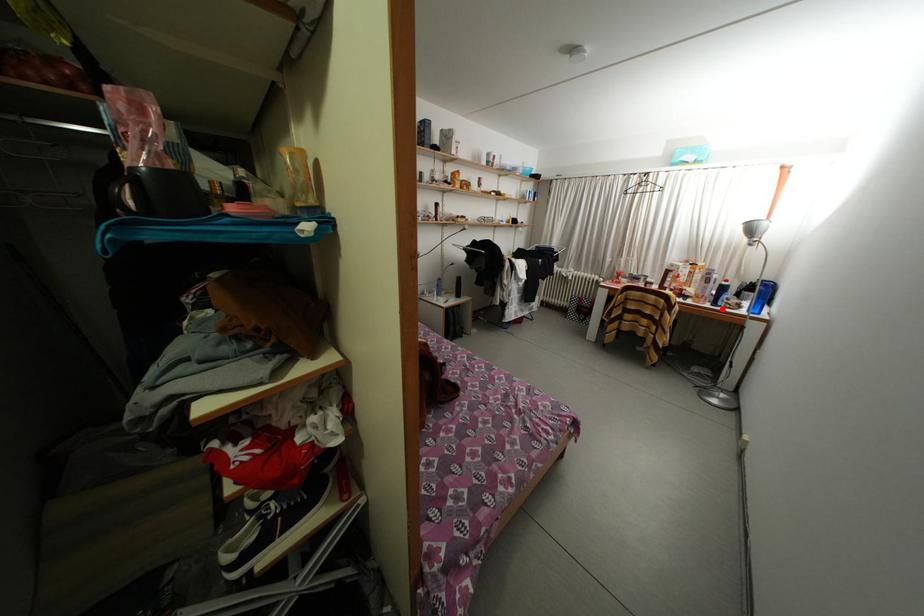
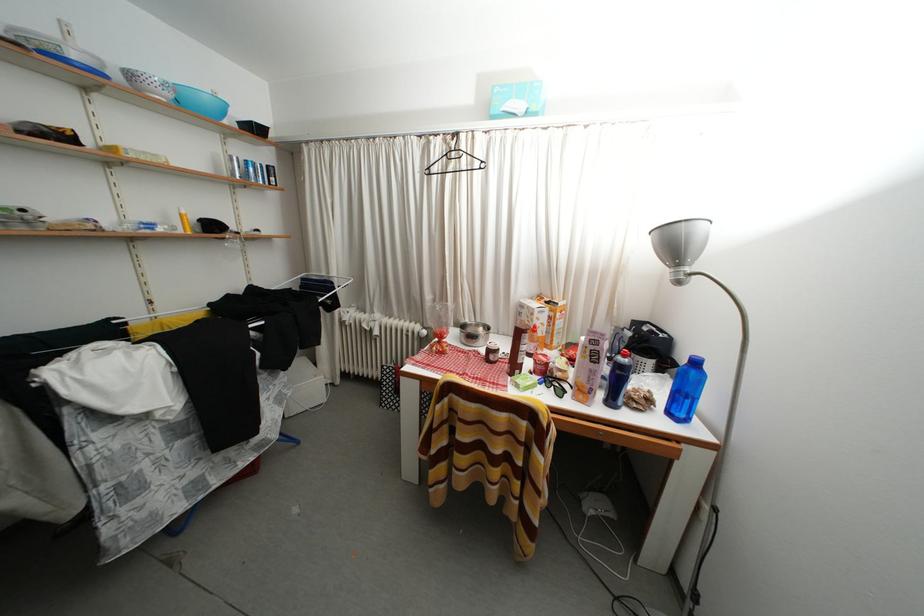
Locate, in the second image, the point that corresponds to the highlighted location in the first image.

(618, 408)